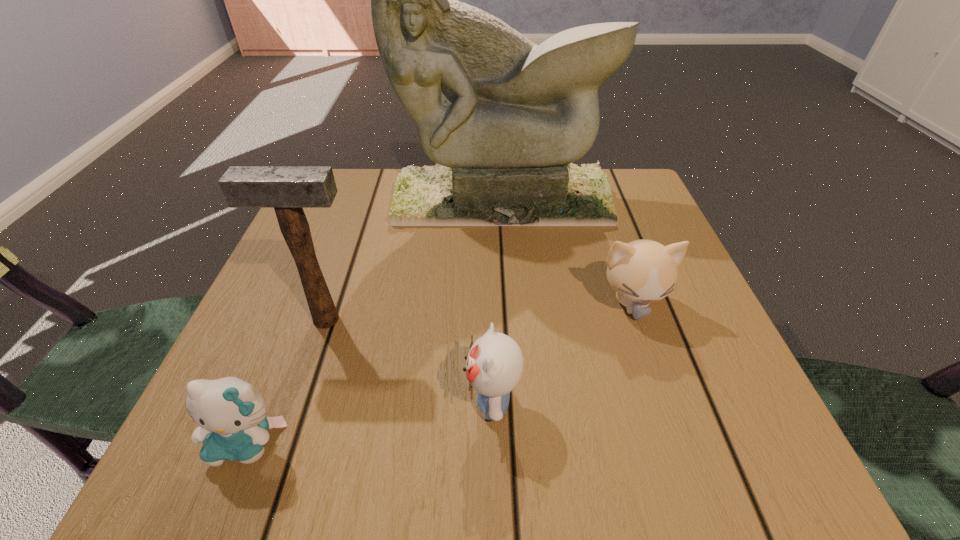
Locate an element on the screen. This screenshot has height=540, width=960. free location that satisfies the following two spatial constraints: 1. on the front-facing side of the second kitten from left to right; 2. on the face of the leftmost kitten is located at coordinates [492, 442].

I want to click on free point that satisfies the following two spatial constraints: 1. on the front-facing side of the second kitten from left to right; 2. on the face of the leftmost kitten, so click(492, 442).